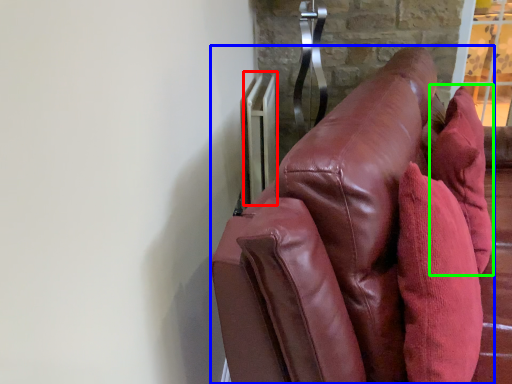
Question: Which is nearer to the radiator (highlighted by a red box)? furniture (highlighted by a blue box) or throw pillow (highlighted by a green box).

Choices:
 (A) furniture
 (B) throw pillow

Answer: (B)